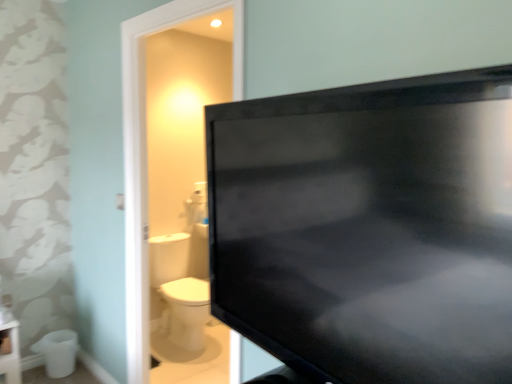
Question: From their relative heights in the image, would you say white glossy toilet bowl at lower left is taller or shorter than black glossy tv at upper right?

Choices:
 (A) short
 (B) tall

Answer: (A)

Question: Is white glossy toilet bowl at lower left bigger or smaller than black glossy tv at upper right?

Choices:
 (A) small
 (B) big

Answer: (A)

Question: From a real-world perspective, is white glossy toilet bowl at lower left above or below black glossy tv at upper right?

Choices:
 (A) above
 (B) below

Answer: (B)

Question: From a real-world perspective, is black glossy tv at upper right above or below white glossy toilet bowl at lower left?

Choices:
 (A) below
 (B) above

Answer: (B)

Question: From their relative heights in the image, would you say black glossy tv at upper right is taller or shorter than white glossy toilet bowl at lower left?

Choices:
 (A) short
 (B) tall

Answer: (B)

Question: In terms of size, does black glossy tv at upper right appear bigger or smaller than white glossy toilet bowl at lower left?

Choices:
 (A) small
 (B) big

Answer: (B)

Question: From the image's perspective, is black glossy tv at upper right above or below white glossy toilet bowl at lower left?

Choices:
 (A) below
 (B) above

Answer: (B)